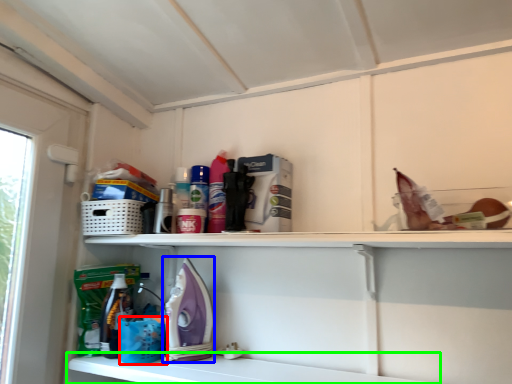
Question: Which object is positioned closest to basket (highlighted by a red box)? Select from appliance (highlighted by a blue box) and shelf (highlighted by a green box).

Choices:
 (A) appliance
 (B) shelf

Answer: (A)